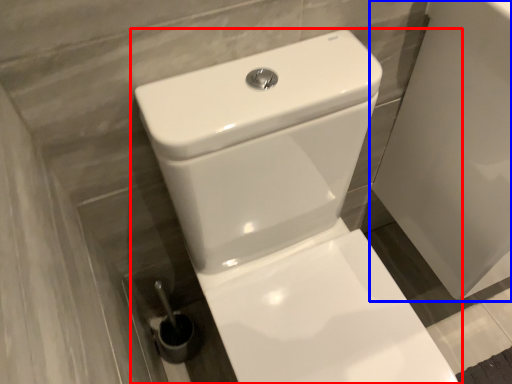
Question: Which object is further to the camera taking this photo, toilet (highlighted by a red box) or porcelain (highlighted by a blue box)?

Choices:
 (A) toilet
 (B) porcelain

Answer: (B)